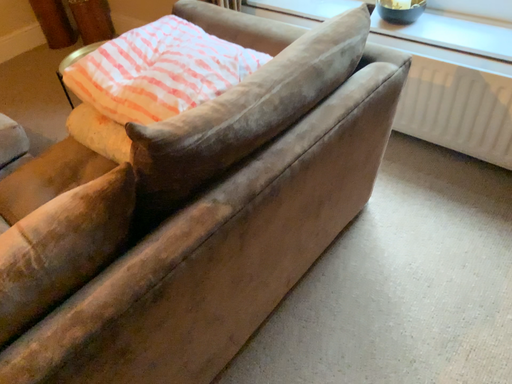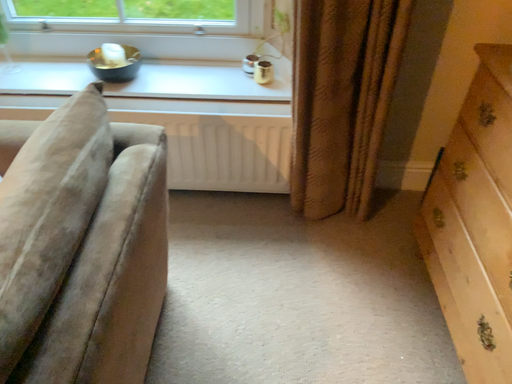
Question: Which way did the camera rotate in the video?

Choices:
 (A) rotated left
 (B) rotated right

Answer: (B)